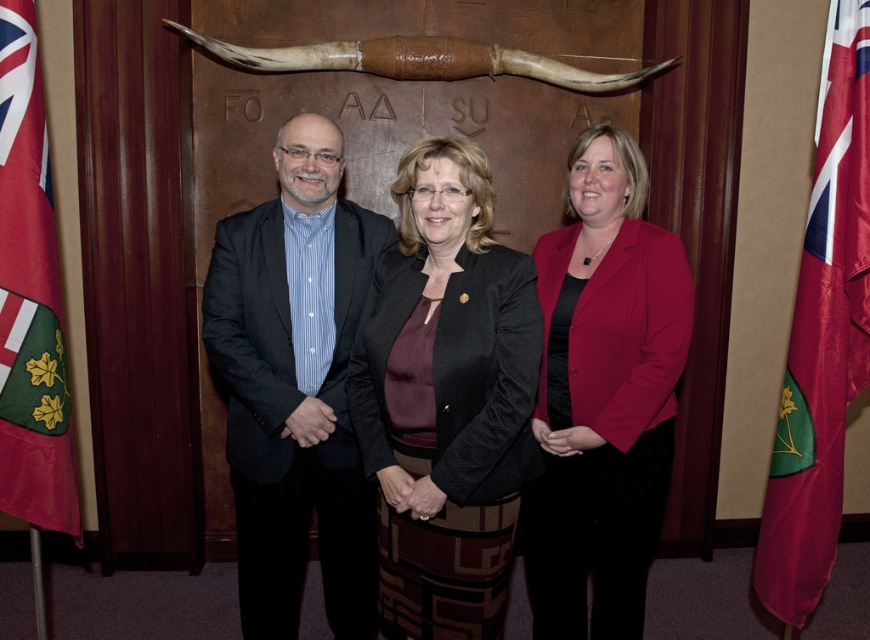
You are a photographer setting up for an event. You need to ensure that the matte red blazer at center and the red fabric flag at left are both visible in your photo. Given their sizes, which object should you focus on first to ensure it doesn

The matte red blazer at center is taller than the red fabric flag at left, so you should focus on capturing the matte red blazer at center first to ensure its full height is visible in the frame.

Please provide the 2D coordinates of the black textured blazer at center in the image. The scene shows three people standing indoors against a carved wooden panel with a horn above text. The individuals include a bald man in a dark blazer on the left, a woman in a black blazer at center, and another person on the right. The coordinates should be in the format of a point like this example format, e.g., point 0.623, 0.514.

The black textured blazer at center is located at point (446, 397) in the image.

You are a photographer taking a portrait of the matte red blazer at center and the red satin flag at right. Which object is shorter in the image?

The matte red blazer at center is shorter than the red satin flag at right.